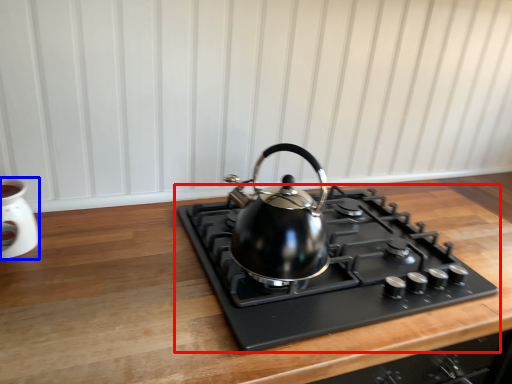
Question: Which object appears farthest to the camera in this image, gas stove (highlighted by a red box) or appliance (highlighted by a blue box)?

Choices:
 (A) gas stove
 (B) appliance

Answer: (B)